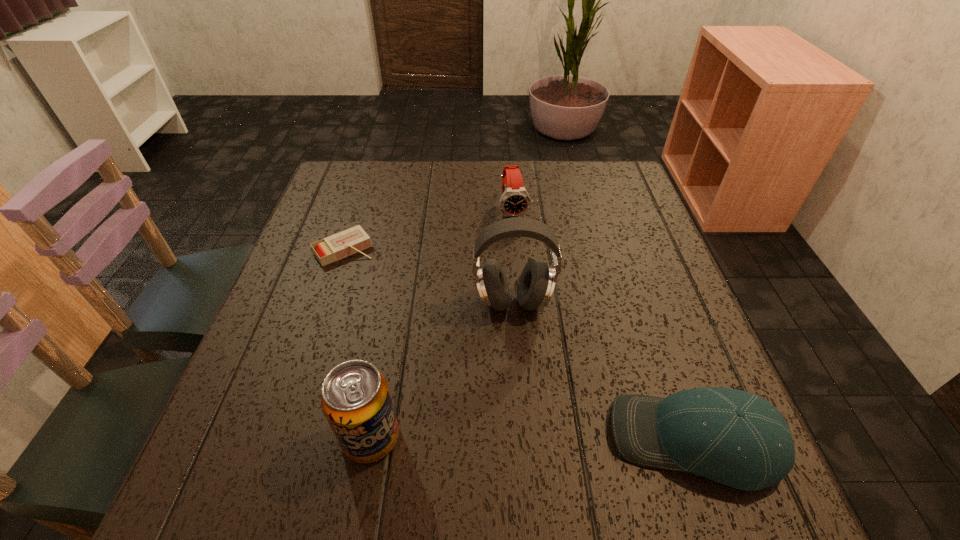
Where is `vacant space at the right edge of the desktop`? Image resolution: width=960 pixels, height=540 pixels. vacant space at the right edge of the desktop is located at coordinates (651, 366).

You are a GUI agent. You are given a task and a screenshot of the screen. Output one action in this format:
    pyautogui.click(x=<x>, y=<y>)
    Task: Click on the free location at the far left corner
    The image size is (960, 540).
    Given the screenshot: What is the action you would take?
    pyautogui.click(x=367, y=176)

Locate an element on the screen. vacant space at the far right corner of the desktop is located at coordinates (612, 200).

Identify the location of vacant space that's between the matchbox and the soda can. (357, 343).

The width and height of the screenshot is (960, 540). In order to click on free area in between the matchbox and the headset in this screenshot , I will do `click(429, 276)`.

Locate an element on the screen. blank region between the headset and the fourth tallest object is located at coordinates (604, 372).

Find the location of a particular element. This screenshot has width=960, height=540. vacant point located between the watch and the second shortest object is located at coordinates (604, 326).

Locate an element on the screen. The height and width of the screenshot is (540, 960). vacant area that lies between the second object from left to right and the matchbox is located at coordinates (357, 343).

Identify the location of free spot between the baseball cap and the soda can. (532, 439).

You are a GUI agent. You are given a task and a screenshot of the screen. Output one action in this format:
    pyautogui.click(x=<x>, y=<y>)
    Task: Click on the vacant space that's between the leftmost object and the tallest object
    Image resolution: width=960 pixels, height=540 pixels.
    Given the screenshot: What is the action you would take?
    pyautogui.click(x=429, y=276)